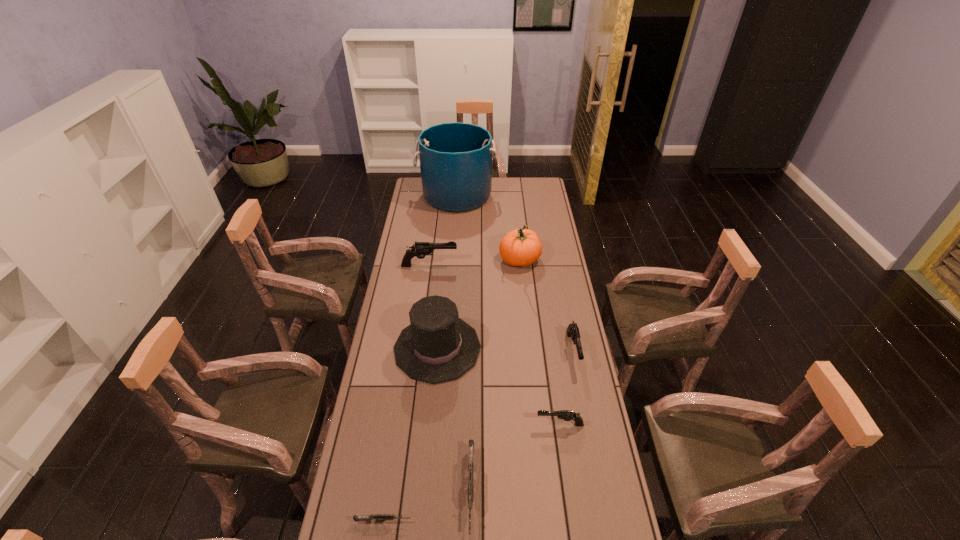
Identify the location of gun that is the third closest one to the purple dress hat. This screenshot has height=540, width=960. (420, 249).

Locate an element on the screen. The width and height of the screenshot is (960, 540). gun that stands as the second closest to the biggest black gun is located at coordinates (567, 415).

Locate an element on the screen. This screenshot has width=960, height=540. black gun that is the closest to the second tallest gun is located at coordinates (567, 415).

Identify which black gun is the second closest to the fourth shortest object. Please provide its 2D coordinates. Your answer should be formatted as a tuple, i.e. [(x, y)], where the tuple contains the x and y coordinates of a point satisfying the conditions above.

[(420, 249)]

I want to click on grey gun object that ranks as the second closest to the leftmost black gun, so click(x=377, y=517).

Select which grey gun is the second closest to the dress hat. Please provide its 2D coordinates. Your answer should be formatted as a tuple, i.e. [(x, y)], where the tuple contains the x and y coordinates of a point satisfying the conditions above.

[(377, 517)]